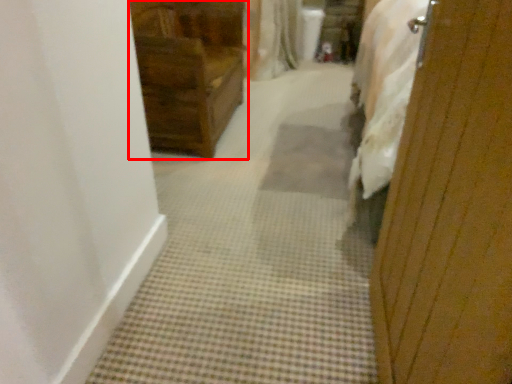
Question: Where is furniture (annotated by the red box) located in relation to screen door in the image?

Choices:
 (A) left
 (B) right

Answer: (A)